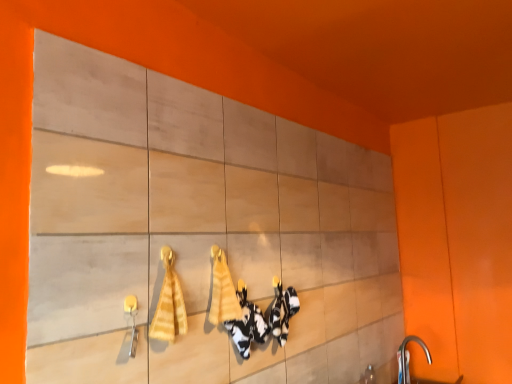
Question: From the image's perspective, is silver metallic faucet at lower right above or below yellow striped towel at center, arranged as the 1th bath towel when viewed from the left?

Choices:
 (A) above
 (B) below

Answer: (B)

Question: From a real-world perspective, is silver metallic faucet at lower right above or below yellow striped towel at center, arranged as the 1th bath towel when viewed from the left?

Choices:
 (A) below
 (B) above

Answer: (A)

Question: Which object is positioned farthest from the yellow striped towel at center, which is counted as the second bath towel, starting from the back?

Choices:
 (A) matte wood cabinet at center
 (B) yellow fabric bath towel at center, the first bath towel from the right
 (C) silver metallic faucet at lower right

Answer: (C)

Question: Estimate the real-world distances between objects in this image. Which object is closer to the silver metallic faucet at lower right?

Choices:
 (A) yellow fabric bath towel at center, the second bath towel in the front-to-back sequence
 (B) matte wood cabinet at center
 (C) yellow striped towel at center, arranged as the 1th bath towel when viewed from the left

Answer: (B)